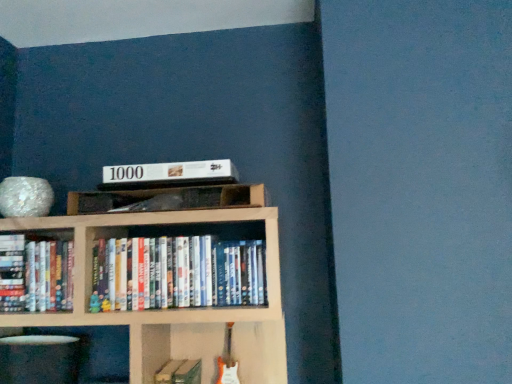
What do you see at coordinates (170, 193) in the screenshot? I see `wooden shelf at center, which appears as the 1th shelf when viewed from the top` at bounding box center [170, 193].

What do you see at coordinates (35, 274) in the screenshot?
I see `hardcover books at left, the 2th book in the top-to-bottom sequence` at bounding box center [35, 274].

What is the approximate width of white glossy dvds at center, the first book from the top?

white glossy dvds at center, the first book from the top, is 16.01 centimeters in width.

At what (x,y) coordinates should I click in order to perform the action: click on white glossy plate at lower left, which ranks as the 1th shelf in bottom-to-top order. Please return your answer as a coordinate pair (x, y). The height and width of the screenshot is (384, 512). Looking at the image, I should click on (96, 351).

Is white matte book at upper center positioned in front of white glossy dvds at center, arranged as the 3th book when ordered from the bottom?

No, it is behind white glossy dvds at center, arranged as the 3th book when ordered from the bottom.

What's the angular difference between white matte book at upper center and white glossy dvds at center, the first book from the top,'s facing directions?

The facing directions of white matte book at upper center and white glossy dvds at center, the first book from the top, are 0.00177 degrees apart.

From the image's perspective, which one is positioned lower, white matte book at upper center or white glossy dvds at center, the 1th book when ordered from right to left?

white glossy dvds at center, the 1th book when ordered from right to left, appears lower in the image.

Consider the image. Is white glossy dvds at center, the 1th book when ordered from right to left, located within white matte book at upper center?

No.

Are hardcover books at left, the 2th book in the top-to-bottom sequence, and wooden shelf at center, which appears as the 1th shelf when viewed from the top, located far from each other?

They are positioned close to each other.

You are a GUI agent. You are given a task and a screenshot of the screen. Output one action in this format:
    pyautogui.click(x=<x>, y=<y>)
    Task: Click on the 2nd shelf counting from the right of the hardcover books at left, positioned as the 1th book in left-to-right order
    The image size is (512, 384).
    Given the screenshot: What is the action you would take?
    pyautogui.click(x=170, y=193)

In the scene shown: Who is taller, hardcover books at left, positioned as the second book in bottom-to-top order, or wooden shelf at center, which is the first shelf from right to left?

hardcover books at left, positioned as the second book in bottom-to-top order.

Between point (21, 280) and point (223, 200), which one is positioned in front?

The point (223, 200) is in front.

Between white matte book at upper center and hardcover books at left, placed as the third book when sorted from right to left, which one has less height?

With less height is white matte book at upper center.

What's the angular difference between white matte book at upper center and hardcover books at left, positioned as the second book in bottom-to-top order,'s facing directions?

0.00203 degrees.

In terms of width, does white matte book at upper center look wider or thinner when compared to hardcover books at left, positioned as the second book in bottom-to-top order?

white matte book at upper center is wider than hardcover books at left, positioned as the second book in bottom-to-top order.

From a real-world perspective, is white matte book at upper center positioned above or below hardcover books at left, positioned as the second book in bottom-to-top order?

Clearly, from a real-world perspective, white matte book at upper center is above hardcover books at left, positioned as the second book in bottom-to-top order.

Where is `the 1st shelf counting from the right of the hardcover books at left, placed as the third book when sorted from right to left`? the 1st shelf counting from the right of the hardcover books at left, placed as the third book when sorted from right to left is located at coordinates (96, 351).

Which object is positioned more to the right, white glossy plate at lower left, placed as the 1th shelf when sorted from left to right, or hardcover books at left, placed as the third book when sorted from right to left?

white glossy plate at lower left, placed as the 1th shelf when sorted from left to right.

In terms of height, does white glossy plate at lower left, which ranks as the 1th shelf in bottom-to-top order, look taller or shorter compared to hardcover books at left, placed as the third book when sorted from right to left?

white glossy plate at lower left, which ranks as the 1th shelf in bottom-to-top order, is shorter than hardcover books at left, placed as the third book when sorted from right to left.

From the image's perspective, would you say white glossy plate at lower left, placed as the 1th shelf when sorted from left to right, is positioned over hardcover books at left, positioned as the 1th book in left-to-right order?

No.

Is point (175, 375) positioned before point (159, 242)?

No.

From a real-world perspective, is hardcover book at center, which appears as the 2th book when viewed from the left, physically located above or below white glossy dvds at center, positioned as the third book in left-to-right order?

In terms of real-world spatial position, hardcover book at center, which appears as the 2th book when viewed from the left, is below white glossy dvds at center, positioned as the third book in left-to-right order.

The width and height of the screenshot is (512, 384). I want to click on the 2nd book below the white glossy dvds at center, arranged as the 3th book when ordered from the bottom (from the image's perspective), so click(179, 372).

Between hardcover books at left, positioned as the second book in bottom-to-top order, and hardcover book at center, acting as the second book starting from the right, which one appears on the left side from the viewer's perspective?

Positioned to the left is hardcover books at left, positioned as the second book in bottom-to-top order.

How far apart are hardcover books at left, the 2th book in the top-to-bottom sequence, and hardcover book at center, which appears as the 1th book when ordered from the bottom?

The distance of hardcover books at left, the 2th book in the top-to-bottom sequence, from hardcover book at center, which appears as the 1th book when ordered from the bottom, is 43.25 centimeters.

Considering the positions of point (48, 268) and point (159, 381), is point (48, 268) closer or farther from the camera than point (159, 381)?

Point (48, 268) is positioned farther from the camera compared to point (159, 381).

From the image's perspective, is hardcover books at left, positioned as the 1th book in left-to-right order, located beneath hardcover book at center, which appears as the 1th book when ordered from the bottom?

No, from the image's perspective, hardcover books at left, positioned as the 1th book in left-to-right order, is not below hardcover book at center, which appears as the 1th book when ordered from the bottom.

Which is less distant, (197, 382) or (29, 332)?

Point (197, 382).

Is hardcover book at center, marked as the 3th book in a top-to-bottom arrangement, oriented towards white glossy plate at lower left, placed as the 1th shelf when sorted from left to right?

No.

Is hardcover book at center, which appears as the 1th book when ordered from the bottom, taller or shorter than white glossy plate at lower left, placed as the 1th shelf when sorted from left to right?

In the image, hardcover book at center, which appears as the 1th book when ordered from the bottom, appears to be taller than white glossy plate at lower left, placed as the 1th shelf when sorted from left to right.

Who is smaller, hardcover book at center, which appears as the 1th book when ordered from the bottom, or white glossy plate at lower left, marked as the 2th shelf in a right-to-left arrangement?

hardcover book at center, which appears as the 1th book when ordered from the bottom, is smaller.

The image size is (512, 384). I want to click on the 2nd book to the right of the white matte book at upper center, starting your count from the anchor, so click(177, 273).

I want to click on shelf above the hardcover books at left, positioned as the 1th book in left-to-right order (from the image's perspective), so click(170, 193).

Based on their spatial positions, is hardcover books at left, the 2th book in the top-to-bottom sequence, or white glossy dvds at center, positioned as the third book in left-to-right order, further from hardcover book at center, which appears as the 2th book when viewed from the left?

hardcover books at left, the 2th book in the top-to-bottom sequence.

Estimate the real-world distances between objects in this image. Which object is further from wooden shelf at center, which appears as the 1th shelf when viewed from the top, hardcover book at center, which appears as the 1th book when ordered from the bottom, or white matte book at upper center?

hardcover book at center, which appears as the 1th book when ordered from the bottom, is further to wooden shelf at center, which appears as the 1th shelf when viewed from the top.

Estimate the real-world distances between objects in this image. Which object is closer to white glossy plate at lower left, placed as the 1th shelf when sorted from left to right, wooden shelf at center, which is the first shelf from right to left, or hardcover book at center, acting as the second book starting from the right?

The object closer to white glossy plate at lower left, placed as the 1th shelf when sorted from left to right, is hardcover book at center, acting as the second book starting from the right.

Looking at the image, which one is located closer to white matte book at upper center, white glossy dvds at center, positioned as the third book in left-to-right order, or wooden shelf at center, which is the first shelf from right to left?

wooden shelf at center, which is the first shelf from right to left, lies closer to white matte book at upper center than the other object.

Consider the image. From the image, which object appears to be farther from white matte book at upper center, hardcover book at center, acting as the second book starting from the right, or wooden shelf at center, which appears as the 1th shelf when viewed from the top?

hardcover book at center, acting as the second book starting from the right.

When comparing their distances from white glossy plate at lower left, positioned as the second shelf in top-to-bottom order, does hardcover books at left, positioned as the second book in bottom-to-top order, or wooden shelf at center, which is the first shelf from right to left, seem further?

wooden shelf at center, which is the first shelf from right to left, is further to white glossy plate at lower left, positioned as the second shelf in top-to-bottom order.

Estimate the real-world distances between objects in this image. Which object is closer to hardcover books at left, positioned as the 1th book in left-to-right order, wooden shelf at center, which is the second shelf from bottom to top, or hardcover book at center, acting as the second book starting from the right?

wooden shelf at center, which is the second shelf from bottom to top, is positioned closer to the anchor hardcover books at left, positioned as the 1th book in left-to-right order.

Based on their spatial positions, is white matte book at upper center or hardcover books at left, positioned as the second book in bottom-to-top order, further from wooden shelf at center, the 2th shelf positioned from the left?

hardcover books at left, positioned as the second book in bottom-to-top order.

This screenshot has width=512, height=384. In order to click on paperback book between hardcover books at left, placed as the third book when sorted from right to left, and white glossy dvds at center, positioned as the third book in left-to-right order, in the horizontal direction in this screenshot , I will do `click(169, 171)`.

At what (x,y) coordinates should I click in order to perform the action: click on shelf between white matte book at upper center and white glossy plate at lower left, placed as the 1th shelf when sorted from left to right, from top to bottom. Please return your answer as a coordinate pair (x, y). Looking at the image, I should click on (170, 193).

Find the location of a particular element. The width and height of the screenshot is (512, 384). shelf between white matte book at upper center and white glossy dvds at center, the 1th book when ordered from right to left, vertically is located at coordinates (170, 193).

This screenshot has width=512, height=384. In order to click on book situated between white glossy plate at lower left, placed as the 1th shelf when sorted from left to right, and white glossy dvds at center, positioned as the third book in left-to-right order, from left to right in this screenshot , I will do `click(179, 372)`.